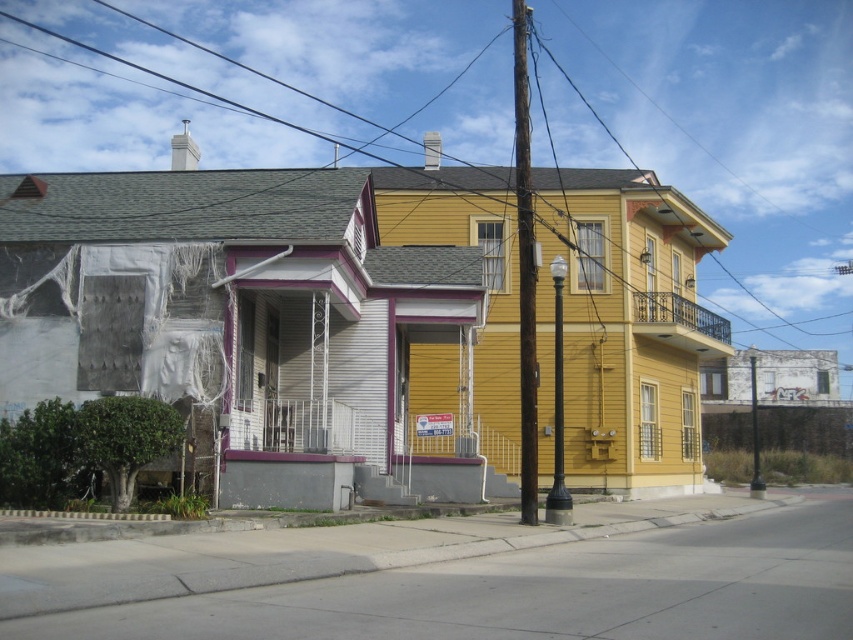
You are a window cleaner standing on the ground floor of the building. You see the black wire at upper center and the brown wooden utility pole at center. Which object is closer to you?

The black wire at upper center is shorter than the brown wooden utility pole at center, so the black wire at upper center is closer to you.

You are standing on the sidewalk in front of the two story residential building. You see a point at coordinate (x=734, y=131). Where is this point located relative to the black wire at upper center?

The point at coordinate (x=734, y=131) is located on the black wire at upper center.